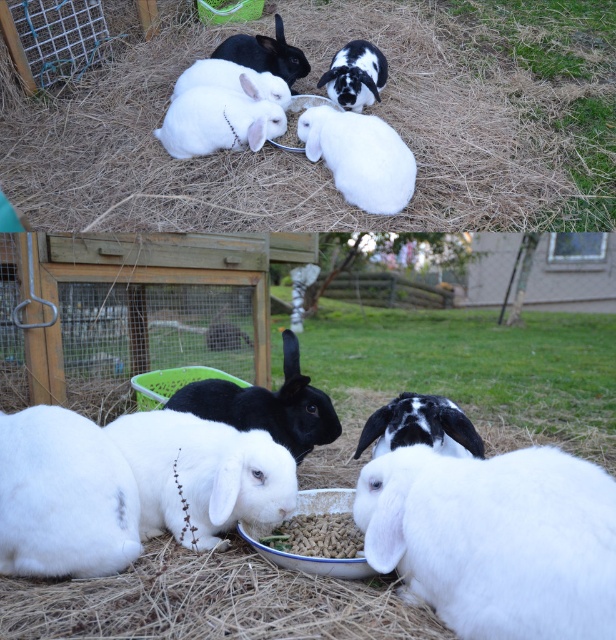
Question: Based on their relative distances, which object is nearer to the black and white fur rabbit at upper center?

Choices:
 (A) white fluffy rabbit at upper center
 (B) white soft fur rabbit at lower left
 (C) white fluffy rabbit at lower left

Answer: (A)

Question: Which object is the farthest from the black soft fur rabbit at upper center?

Choices:
 (A) black matte rabbit at center
 (B) white fluffy rabbit at lower right
 (C) white fluffy rabbit at center
 (D) black fur rabbit at center

Answer: (B)

Question: Is black and white fur rabbit at upper center further to the viewer compared to black soft fur rabbit at upper center?

Choices:
 (A) yes
 (B) no

Answer: (B)

Question: Where is white fluffy rabbit at lower right located in relation to white fluffy rabbit at upper center in the image?

Choices:
 (A) right
 (B) left

Answer: (A)

Question: In this image, where is black matte rabbit at center located relative to black and white fur rabbit at upper center?

Choices:
 (A) below
 (B) above

Answer: (A)

Question: Which point is closer to the camera taking this photo?

Choices:
 (A) (455, 404)
 (B) (283, 108)
 (C) (387, 122)
 (D) (351, 545)

Answer: (D)